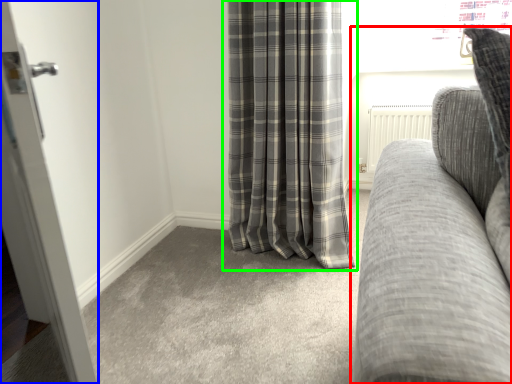
Question: Which object is the farthest from studio couch (highlighted by a red box)? Choose among these: door (highlighted by a blue box) or curtain (highlighted by a green box).

Choices:
 (A) door
 (B) curtain

Answer: (B)